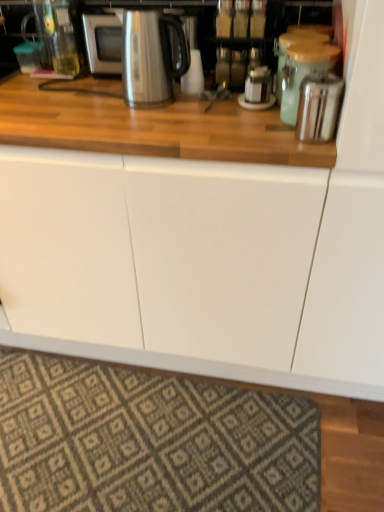
Locate an element on the screen. Image resolution: width=384 pixels, height=512 pixels. green matte jar at upper right, which appears as the 2th appliance when viewed from the front is located at coordinates (303, 72).

Describe the element at coordinates (150, 57) in the screenshot. Image resolution: width=384 pixels, height=512 pixels. I see `stainless steel kettle at upper center` at that location.

At what (x,y) coordinates should I click in order to perform the action: click on stainless steel kettle at upper center. Please return your answer as a coordinate pair (x, y). Looking at the image, I should click on (150, 57).

You are a GUI agent. You are given a task and a screenshot of the screen. Output one action in this format:
    pyautogui.click(x=<x>, y=<y>)
    Task: Click on the metallic silver canister at upper right, the third appliance in the front-to-back sequence
    Image resolution: width=384 pixels, height=512 pixels.
    Given the screenshot: What is the action you would take?
    pyautogui.click(x=293, y=44)

Find the location of a particular element. green matte jar at upper right, acting as the second appliance starting from the back is located at coordinates (303, 72).

Considering the positions of objects metallic silver canister at upper right, the third appliance in the front-to-back sequence, and stainless steel kettle at upper center in the image provided, who is more to the left, metallic silver canister at upper right, the third appliance in the front-to-back sequence, or stainless steel kettle at upper center?

Positioned to the left is stainless steel kettle at upper center.

From a real-world perspective, count 2nd appliances downward from the stainless steel kettle at upper center and point to it. Please provide its 2D coordinates.

[(293, 44)]

Is metallic silver canister at upper right, the third appliance in the front-to-back sequence, not close to stainless steel kettle at upper center?

Actually, metallic silver canister at upper right, the third appliance in the front-to-back sequence, and stainless steel kettle at upper center are a little close together.

Based on the photo, looking at their sizes, would you say metallic silver canister at upper right, arranged as the first appliance when viewed from the back, is wider or thinner than stainless steel kettle at upper center?

Clearly, metallic silver canister at upper right, arranged as the first appliance when viewed from the back, has less width compared to stainless steel kettle at upper center.

Find the location of a particular element. This screenshot has width=384, height=512. mat on the left of green matte jar at upper right, which appears as the 2th appliance when viewed from the front is located at coordinates (149, 441).

Does point (289, 112) come farther from viewer compared to point (263, 508)?

No, it is not.

Between green matte jar at upper right, acting as the second appliance starting from the back, and patterned carpet at lower center, which one appears on the left side from the viewer's perspective?

patterned carpet at lower center is more to the left.

Is patterned carpet at lower center next to satin silver microwave at upper center?

No.

In the scene shown: How different are the orientations of patterned carpet at lower center and satin silver microwave at upper center in degrees?

The angle between the facing direction of patterned carpet at lower center and the facing direction of satin silver microwave at upper center is 0.263 degrees.

Looking at their sizes, would you say patterned carpet at lower center is wider or thinner than satin silver microwave at upper center?

In the image, patterned carpet at lower center appears to be wider than satin silver microwave at upper center.

Which point is more distant from viewer, (299,135) or (124,67)?

The point (124,67) is more distant.

Is satin silver toaster at upper right, the first appliance from the front, oriented towards stainless steel kettle at upper center?

No, satin silver toaster at upper right, the first appliance from the front, is not aimed at stainless steel kettle at upper center.

Locate an element on the screen. Image resolution: width=384 pixels, height=512 pixels. kitchen appliance above the satin silver toaster at upper right, the first appliance from the front (from the image's perspective) is located at coordinates (150, 57).

Who is bigger, stainless steel kettle at upper center or green matte jar at upper right, acting as the second appliance starting from the back?

Bigger between the two is stainless steel kettle at upper center.

Consider the image. Which of these two, stainless steel kettle at upper center or green matte jar at upper right, which appears as the 2th appliance when viewed from the front, stands shorter?

With less height is green matte jar at upper right, which appears as the 2th appliance when viewed from the front.

Visually, is stainless steel kettle at upper center positioned to the left or to the right of green matte jar at upper right, acting as the second appliance starting from the back?

From the image, it's evident that stainless steel kettle at upper center is to the left of green matte jar at upper right, acting as the second appliance starting from the back.

Could you tell me if stainless steel kettle at upper center is turned towards green matte jar at upper right, which appears as the 2th appliance when viewed from the front?

No.

How many degrees apart are the facing directions of green matte jar at upper right, acting as the second appliance starting from the back, and stainless steel kettle at upper center?

There is a 1.51-degree angle between the facing directions of green matte jar at upper right, acting as the second appliance starting from the back, and stainless steel kettle at upper center.

Is stainless steel kettle at upper center at the back of green matte jar at upper right, which appears as the 2th appliance when viewed from the front?

green matte jar at upper right, which appears as the 2th appliance when viewed from the front, does not have its back to stainless steel kettle at upper center.

Considering the sizes of objects green matte jar at upper right, which appears as the 2th appliance when viewed from the front, and stainless steel kettle at upper center in the image provided, who is thinner, green matte jar at upper right, which appears as the 2th appliance when viewed from the front, or stainless steel kettle at upper center?

green matte jar at upper right, which appears as the 2th appliance when viewed from the front, is thinner.

Is green matte jar at upper right, which appears as the 2th appliance when viewed from the front, at the right side of stainless steel kettle at upper center?

Correct, you'll find green matte jar at upper right, which appears as the 2th appliance when viewed from the front, to the right of stainless steel kettle at upper center.

Does patterned carpet at lower center come in front of metallic silver canister at upper right, arranged as the first appliance when viewed from the back?

No, the depth of patterned carpet at lower center is greater than that of metallic silver canister at upper right, arranged as the first appliance when viewed from the back.

Which object is thinner, patterned carpet at lower center or metallic silver canister at upper right, the third appliance in the front-to-back sequence?

With smaller width is metallic silver canister at upper right, the third appliance in the front-to-back sequence.

Is patterned carpet at lower center oriented away from metallic silver canister at upper right, the third appliance in the front-to-back sequence?

patterned carpet at lower center is not turned away from metallic silver canister at upper right, the third appliance in the front-to-back sequence.

The width and height of the screenshot is (384, 512). Find the location of `mat beneath the metallic silver canister at upper right, the third appliance in the front-to-back sequence (from a real-world perspective)`. mat beneath the metallic silver canister at upper right, the third appliance in the front-to-back sequence (from a real-world perspective) is located at coordinates (149, 441).

I want to click on appliance located behind the stainless steel kettle at upper center, so click(x=293, y=44).

Locate an element on the screen. the 2nd appliance above the patterned carpet at lower center (from the image's perspective) is located at coordinates (303, 72).

From the image, which object appears to be farther from patterned carpet at lower center, satin silver toaster at upper right, the first appliance from the front, or satin silver microwave at upper center?

Among the two, satin silver microwave at upper center is located further to patterned carpet at lower center.

Based on their spatial positions, is satin silver toaster at upper right, the first appliance from the front, or patterned carpet at lower center further from metallic silver canister at upper right, the third appliance in the front-to-back sequence?

patterned carpet at lower center.

Estimate the real-world distances between objects in this image. Which object is closer to green matte jar at upper right, which appears as the 2th appliance when viewed from the front, metallic silver canister at upper right, the third appliance in the front-to-back sequence, or stainless steel kettle at upper center?

metallic silver canister at upper right, the third appliance in the front-to-back sequence, is closer to green matte jar at upper right, which appears as the 2th appliance when viewed from the front.

Considering their positions, is satin silver microwave at upper center positioned closer to satin silver toaster at upper right, the first appliance from the front, than metallic silver canister at upper right, the third appliance in the front-to-back sequence?

metallic silver canister at upper right, the third appliance in the front-to-back sequence, lies closer to satin silver toaster at upper right, the first appliance from the front, than the other object.

Looking at this image, estimate the real-world distances between objects in this image. Which object is closer to satin silver toaster at upper right, which appears as the third appliance when viewed from the back, green matte jar at upper right, acting as the second appliance starting from the back, or satin silver microwave at upper center?

green matte jar at upper right, acting as the second appliance starting from the back, lies closer to satin silver toaster at upper right, which appears as the third appliance when viewed from the back, than the other object.

From the image, which object appears to be nearer to green matte jar at upper right, acting as the second appliance starting from the back, patterned carpet at lower center or satin silver toaster at upper right, which appears as the third appliance when viewed from the back?

satin silver toaster at upper right, which appears as the third appliance when viewed from the back, is positioned closer to the anchor green matte jar at upper right, acting as the second appliance starting from the back.

From the image, which object appears to be nearer to green matte jar at upper right, acting as the second appliance starting from the back, satin silver microwave at upper center or satin silver toaster at upper right, the first appliance from the front?

Based on the image, satin silver toaster at upper right, the first appliance from the front, appears to be nearer to green matte jar at upper right, acting as the second appliance starting from the back.

Based on their spatial positions, is stainless steel kettle at upper center or metallic silver canister at upper right, the third appliance in the front-to-back sequence, closer to patterned carpet at lower center?

stainless steel kettle at upper center.

Where is `appliance that lies between metallic silver canister at upper right, arranged as the first appliance when viewed from the back, and satin silver toaster at upper right, which appears as the third appliance when viewed from the back, from top to bottom`? This screenshot has width=384, height=512. appliance that lies between metallic silver canister at upper right, arranged as the first appliance when viewed from the back, and satin silver toaster at upper right, which appears as the third appliance when viewed from the back, from top to bottom is located at coordinates tap(303, 72).

In order to click on appliance between green matte jar at upper right, which appears as the 2th appliance when viewed from the front, and patterned carpet at lower center in the up-down direction in this screenshot , I will do `click(319, 106)`.

Identify the location of appliance between satin silver microwave at upper center and metallic silver canister at upper right, the third appliance in the front-to-back sequence, from left to right. Image resolution: width=384 pixels, height=512 pixels. (303, 72).

Locate an element on the screen. kitchen appliance between satin silver microwave at upper center and satin silver toaster at upper right, which appears as the third appliance when viewed from the back, in the horizontal direction is located at coordinates pyautogui.click(x=150, y=57).